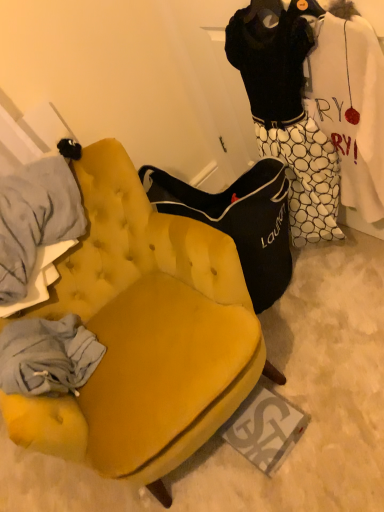
Question: Choose the correct answer: Is black jersey at upper right inside velvet yellow chair at center or outside it?

Choices:
 (A) inside
 (B) outside

Answer: (B)

Question: In terms of width, does black jersey at upper right look wider or thinner when compared to velvet yellow chair at center?

Choices:
 (A) wide
 (B) thin

Answer: (B)

Question: From a real-world perspective, is black jersey at upper right physically located above or below velvet yellow chair at center?

Choices:
 (A) above
 (B) below

Answer: (A)

Question: From a real-world perspective, is velvet yellow chair at center physically located above or below black jersey at upper right?

Choices:
 (A) above
 (B) below

Answer: (B)

Question: Is point (178, 247) closer or farther from the camera than point (284, 95)?

Choices:
 (A) farther
 (B) closer

Answer: (A)

Question: Is velvet yellow chair at center taller or shorter than black jersey at upper right?

Choices:
 (A) short
 (B) tall

Answer: (A)

Question: Looking at the image, does velvet yellow chair at center seem bigger or smaller compared to black jersey at upper right?

Choices:
 (A) big
 (B) small

Answer: (A)